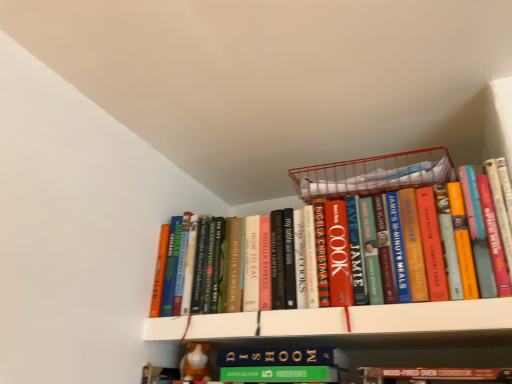
Question: Can you confirm if metallic wire basket at upper center is positioned to the right of hardcover books at center?

Choices:
 (A) yes
 (B) no

Answer: (A)

Question: Is metallic wire basket at upper center shorter than hardcover books at center?

Choices:
 (A) yes
 (B) no

Answer: (A)

Question: Does metallic wire basket at upper center have a greater height compared to hardcover books at center?

Choices:
 (A) no
 (B) yes

Answer: (A)

Question: Is metallic wire basket at upper center outside hardcover books at center?

Choices:
 (A) yes
 (B) no

Answer: (A)

Question: Considering the relative positions of metallic wire basket at upper center and hardcover books at center in the image provided, is metallic wire basket at upper center in front of hardcover books at center?

Choices:
 (A) yes
 (B) no

Answer: (B)

Question: In terms of width, does hardcover books at center look wider or thinner when compared to white matte bookshelf at upper center?

Choices:
 (A) thin
 (B) wide

Answer: (A)

Question: Do you think hardcover books at center is within white matte bookshelf at upper center, or outside of it?

Choices:
 (A) inside
 (B) outside

Answer: (B)

Question: Is hardcover books at center in front of or behind white matte bookshelf at upper center in the image?

Choices:
 (A) front
 (B) behind

Answer: (B)

Question: In terms of size, does hardcover books at center appear bigger or smaller than white matte bookshelf at upper center?

Choices:
 (A) big
 (B) small

Answer: (A)

Question: Is orange fabric dog at lower center taller or shorter than hardcover books at center?

Choices:
 (A) tall
 (B) short

Answer: (B)

Question: Does point (207, 347) appear closer or farther from the camera than point (497, 162)?

Choices:
 (A) farther
 (B) closer

Answer: (A)

Question: Based on their positions, is orange fabric dog at lower center located to the left or right of hardcover books at center?

Choices:
 (A) left
 (B) right

Answer: (A)

Question: In terms of width, does orange fabric dog at lower center look wider or thinner when compared to hardcover books at center?

Choices:
 (A) wide
 (B) thin

Answer: (B)

Question: Do you think metallic wire basket at upper center is within hardcover books at center, or outside of it?

Choices:
 (A) inside
 (B) outside

Answer: (B)

Question: Considering the positions of point (303, 183) and point (346, 301), is point (303, 183) closer or farther from the camera than point (346, 301)?

Choices:
 (A) farther
 (B) closer

Answer: (A)